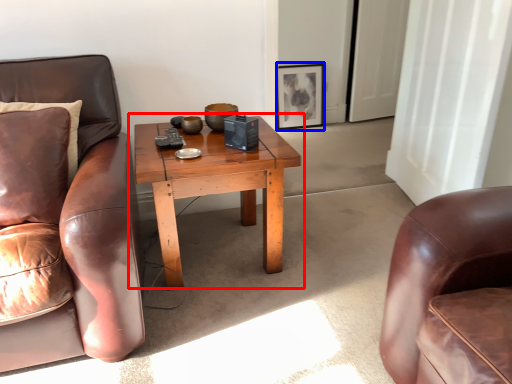
Question: Which point is further to the camera, coffee table (highlighted by a red box) or picture frame (highlighted by a blue box)?

Choices:
 (A) coffee table
 (B) picture frame

Answer: (B)